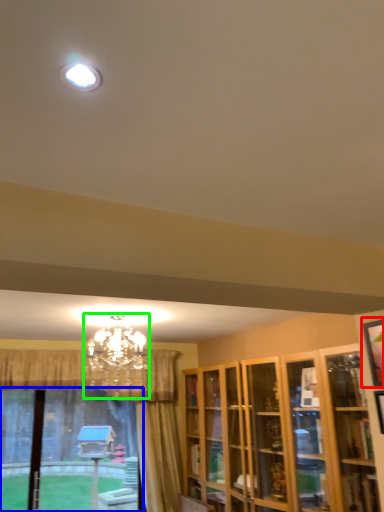
Question: Which object is the farthest from picture frame (highlighted by a red box)? Choose among these: bay window (highlighted by a blue box) or lamp (highlighted by a green box).

Choices:
 (A) bay window
 (B) lamp

Answer: (A)